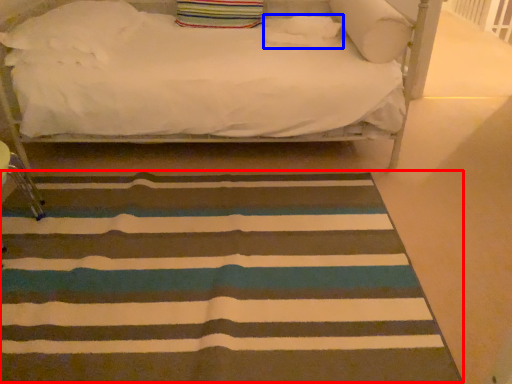
Question: Among these objects, which one is nearest to the camera, mat (highlighted by a red box) or pillow (highlighted by a blue box)?

Choices:
 (A) mat
 (B) pillow

Answer: (A)